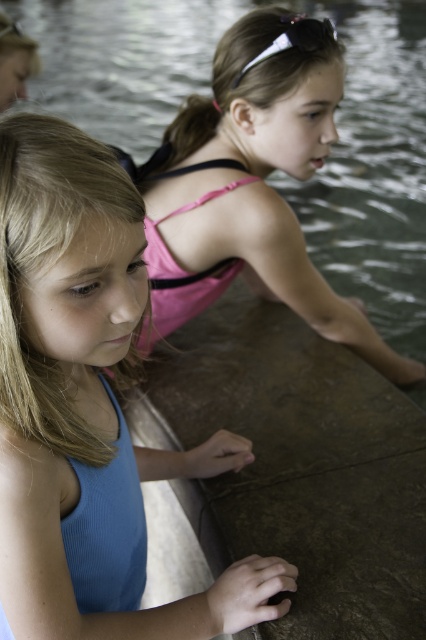
Question: Among these objects, which one is farthest from the camera?

Choices:
 (A) blue fabric swimsuit at left
 (B) pink fabric swimsuit at upper center

Answer: (B)

Question: Can you confirm if blue fabric swimsuit at left is thinner than pink fabric swimsuit at upper center?

Choices:
 (A) yes
 (B) no

Answer: (A)

Question: Does blue fabric swimsuit at left appear over pink fabric swimsuit at upper center?

Choices:
 (A) yes
 (B) no

Answer: (B)

Question: From the image, what is the correct spatial relationship of blue fabric swimsuit at left in relation to pink fabric swimsuit at upper center?

Choices:
 (A) above
 (B) below

Answer: (B)

Question: Which point appears closest to the camera in this image?

Choices:
 (A) (180, 189)
 (B) (135, 468)

Answer: (B)